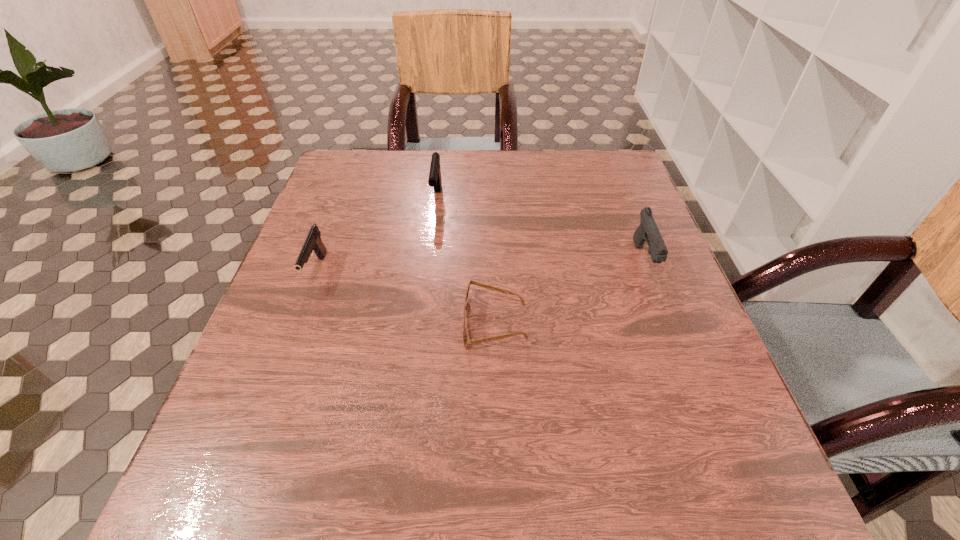
Where is `vacant space in between the rightmost object and the leftmost object`? This screenshot has height=540, width=960. vacant space in between the rightmost object and the leftmost object is located at coordinates (480, 266).

Where is `vacant area between the rightmost object and the leftmost pistol`? vacant area between the rightmost object and the leftmost pistol is located at coordinates (480, 266).

This screenshot has width=960, height=540. Identify the location of empty location between the shortest pistol and the sunglasses. (406, 298).

You are a GUI agent. You are given a task and a screenshot of the screen. Output one action in this format:
    pyautogui.click(x=<x>, y=<y>)
    Task: Click on the object that ranks as the second closest to the farthest pistol
    
    Given the screenshot: What is the action you would take?
    466,340

The width and height of the screenshot is (960, 540). What are the coordinates of `object that is the second closest to the sunglasses` in the screenshot? It's located at (434, 180).

Identify which pistol is the third nearest to the second object from right to left. Please provide its 2D coordinates. Your answer should be formatted as a tuple, i.e. [(x, y)], where the tuple contains the x and y coordinates of a point satisfying the conditions above.

[(313, 243)]

Locate which pistol is the second closest to the rightmost object. Please provide its 2D coordinates. Your answer should be formatted as a tuple, i.e. [(x, y)], where the tuple contains the x and y coordinates of a point satisfying the conditions above.

[(313, 243)]

The height and width of the screenshot is (540, 960). Identify the location of free space in the image that satisfies the following two spatial constraints: 1. at the barrel of the rightmost object; 2. on the frames of the shortest object. (668, 324).